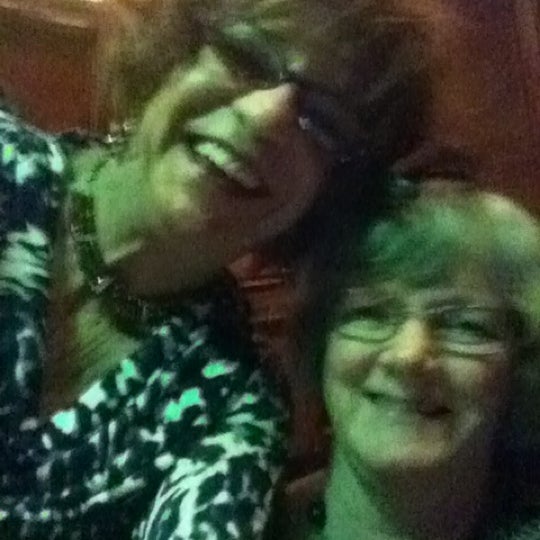
I want to click on door, so click(x=62, y=87).